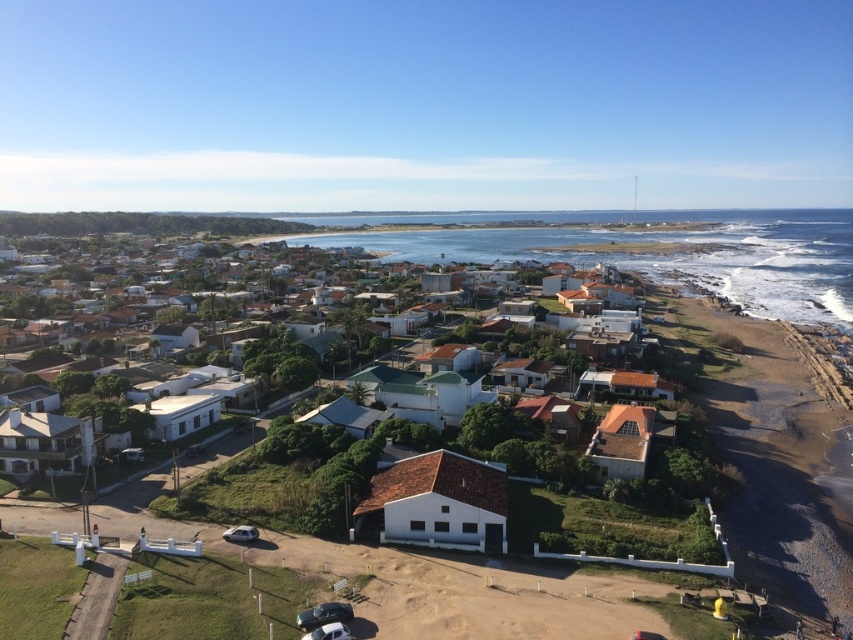
Question: Can you confirm if white matte house at center is bigger than blue water at center?

Choices:
 (A) yes
 (B) no

Answer: (B)

Question: Does white matte house at center come behind blue water at center?

Choices:
 (A) yes
 (B) no

Answer: (B)

Question: Which object is closer to the camera taking this photo?

Choices:
 (A) blue water at center
 (B) white matte house at center

Answer: (B)

Question: Can you confirm if white matte house at center is positioned to the left of blue water at center?

Choices:
 (A) no
 (B) yes

Answer: (B)

Question: Which point is farther to the camera?

Choices:
 (A) blue water at center
 (B) white matte house at center

Answer: (A)

Question: Which point appears closest to the camera in this image?

Choices:
 (A) (344, 440)
 (B) (833, 320)

Answer: (A)